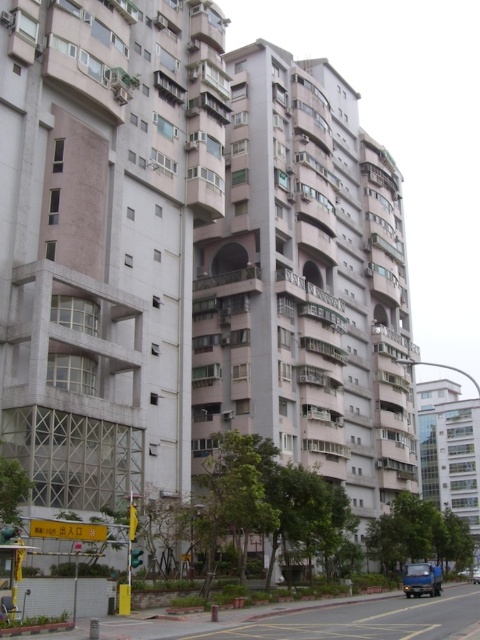
Question: Considering the relative positions of blue matte truck at lower right and metallic silver car at center in the image provided, where is blue matte truck at lower right located with respect to metallic silver car at center?

Choices:
 (A) above
 (B) below

Answer: (A)

Question: Where is blue matte truck at lower right located in relation to metallic silver car at center in the image?

Choices:
 (A) right
 (B) left

Answer: (B)

Question: Which point is closer to the camera?

Choices:
 (A) (477, 564)
 (B) (431, 588)

Answer: (B)

Question: Is blue matte truck at lower right wider than metallic silver car at center?

Choices:
 (A) no
 (B) yes

Answer: (A)

Question: Among these objects, which one is farthest from the camera?

Choices:
 (A) blue matte truck at lower right
 (B) metallic silver car at center

Answer: (B)